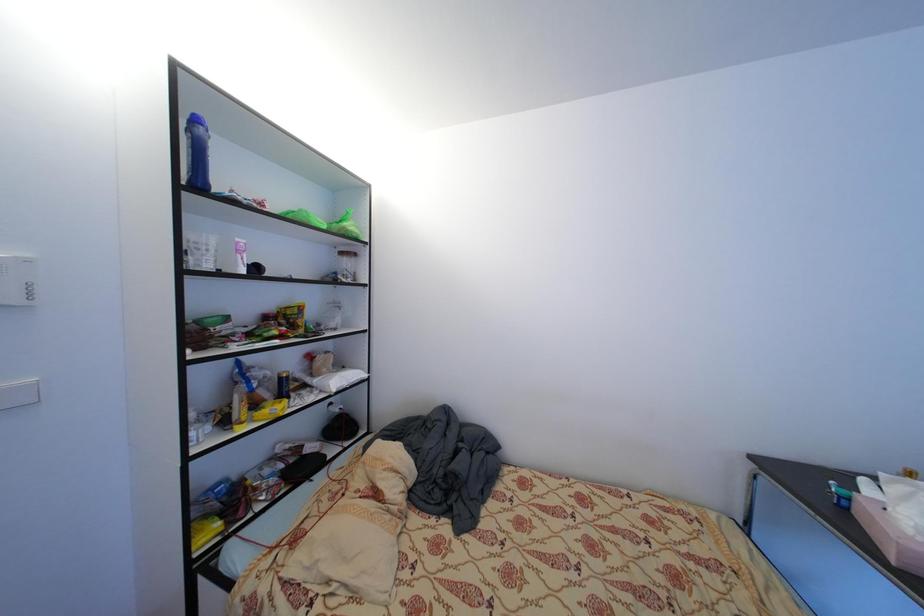
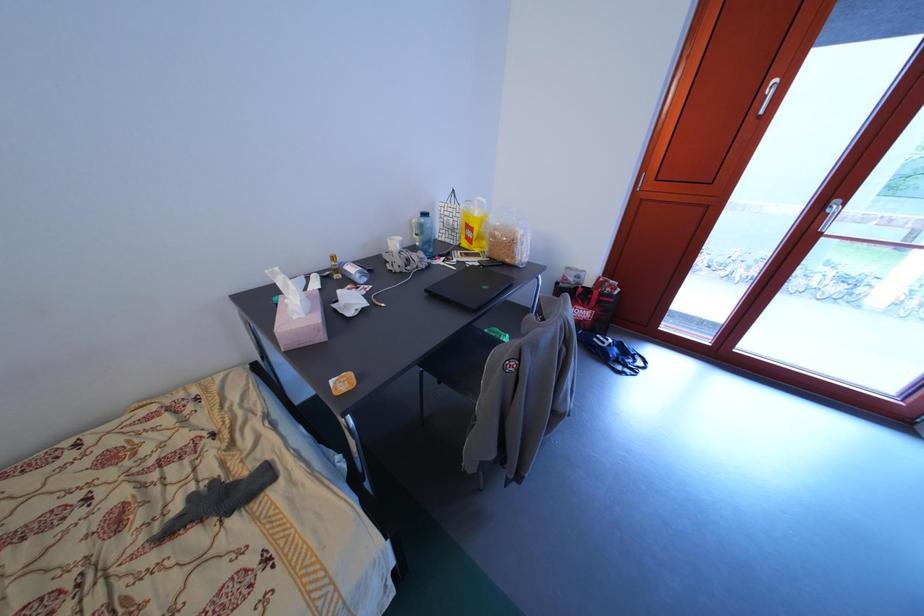
How did the camera likely rotate?

The rotation direction of the camera is right-down.